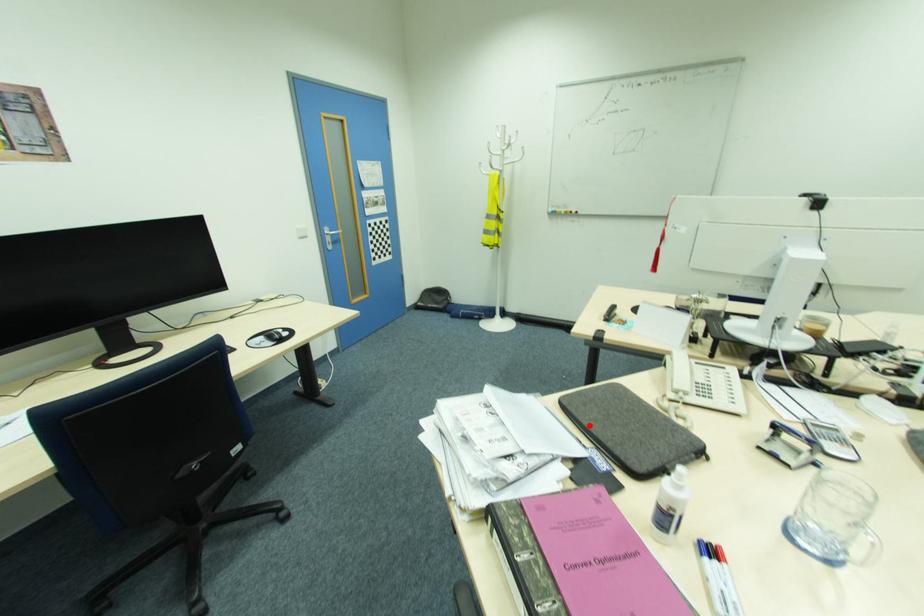
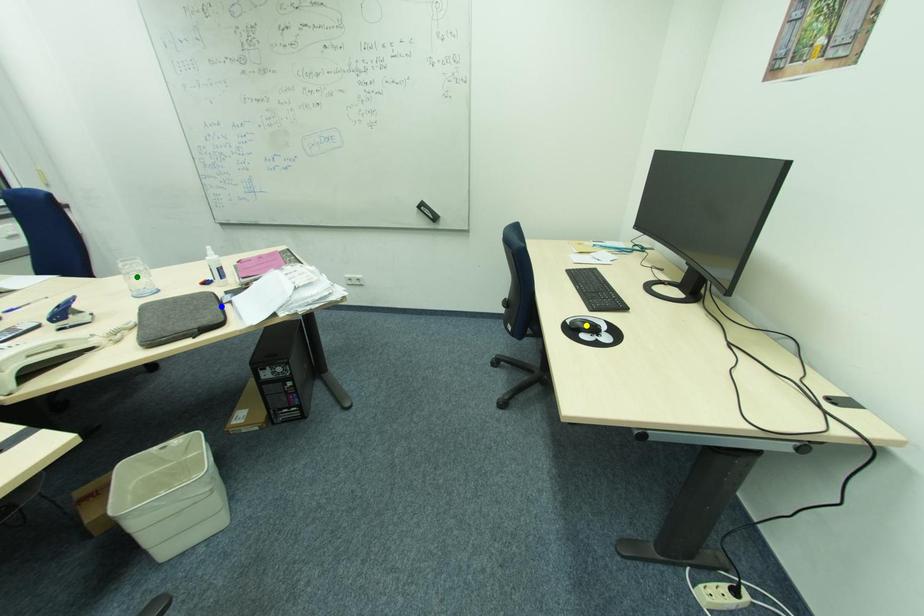
Question: I am providing you with two images of the same scene from different viewpoints. A red point is marked on the first image. You are given multiple points on the second image. Which spot in image 2 lines up with the point in image 1?

Choices:
 (A) blue point
 (B) yellow point
 (C) green point

Answer: (A)